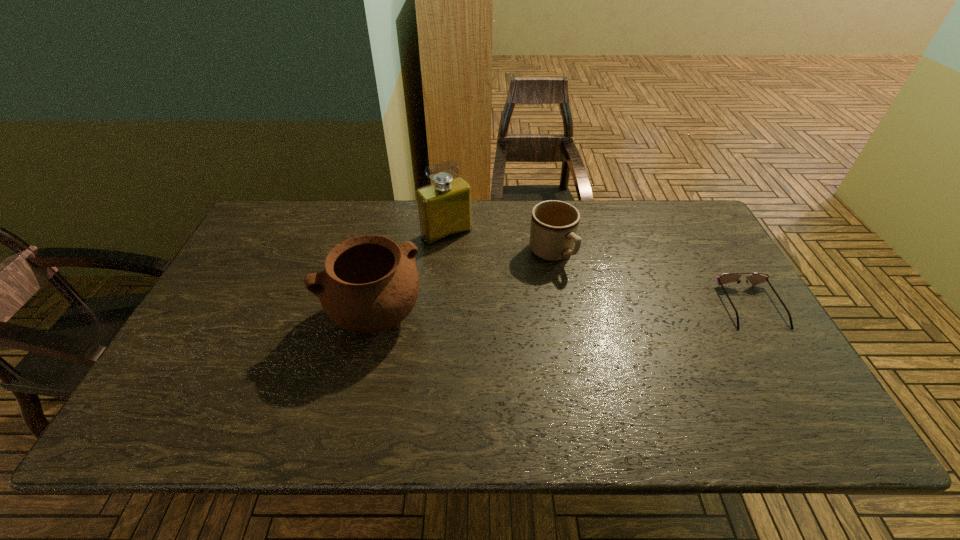
The image size is (960, 540). I want to click on vacant space at the right edge, so click(708, 328).

In the image, there is a desktop. Where is `free space at the far left corner`? This screenshot has height=540, width=960. free space at the far left corner is located at coordinates (286, 218).

I want to click on vacant point at the near left corner, so click(x=230, y=383).

Find the location of a particular element. The height and width of the screenshot is (540, 960). vacant space at the far right corner of the desktop is located at coordinates (696, 222).

I want to click on vacant area that lies between the second object from right to left and the third shortest object, so click(463, 285).

You are a GUI agent. You are given a task and a screenshot of the screen. Output one action in this format:
    pyautogui.click(x=<x>, y=<y>)
    Task: Click on the free spot between the third shortest object and the sunglasses
    
    Given the screenshot: What is the action you would take?
    pyautogui.click(x=563, y=311)

The width and height of the screenshot is (960, 540). What are the coordinates of `free space between the mug and the tallest object` in the screenshot? It's located at (499, 243).

Find the location of a particular element. free spot between the second shortest object and the perfume is located at coordinates (499, 243).

In order to click on free space between the rightmost object and the perfume in this screenshot , I will do `click(598, 269)`.

Where is `empty space that is in between the second shortest object and the rightmost object`? empty space that is in between the second shortest object and the rightmost object is located at coordinates (651, 279).